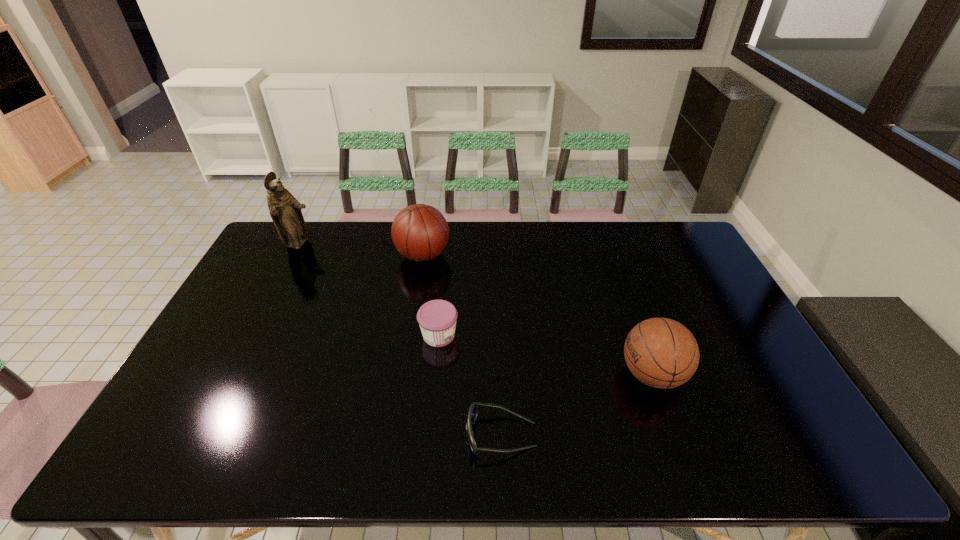
Identify the location of free location located on the side with brand label of the rightmost object. (530, 374).

What are the coordinates of `free space located on the side with brand label of the rightmost object` in the screenshot? It's located at point(586,374).

Find the location of a particular element. This screenshot has height=540, width=960. blank space located 0.190m on the side with brand label of the rightmost object is located at coordinates (549, 374).

The image size is (960, 540). Find the location of `free space located 0.320m on the front label of the jam`. free space located 0.320m on the front label of the jam is located at coordinates 567,335.

This screenshot has height=540, width=960. I want to click on vacant space located 0.150m on the front-facing side of the nearest object, so click(x=404, y=435).

This screenshot has width=960, height=540. I want to click on vacant region located 0.070m on the front-facing side of the nearest object, so click(437, 435).

This screenshot has width=960, height=540. I want to click on free space located 0.060m on the front-facing side of the nearest object, so tap(442, 435).

Where is `figurine situated at the far edge`? figurine situated at the far edge is located at coordinates (285, 210).

The width and height of the screenshot is (960, 540). Identify the location of basketball that is at the far edge. (420, 232).

You are a GUI agent. You are given a task and a screenshot of the screen. Output one action in this format:
    pyautogui.click(x=<x>, y=<y>)
    Task: Click on the object at the near edge
    Image resolution: width=960 pixels, height=540 pixels.
    Given the screenshot: What is the action you would take?
    pyautogui.click(x=473, y=410)